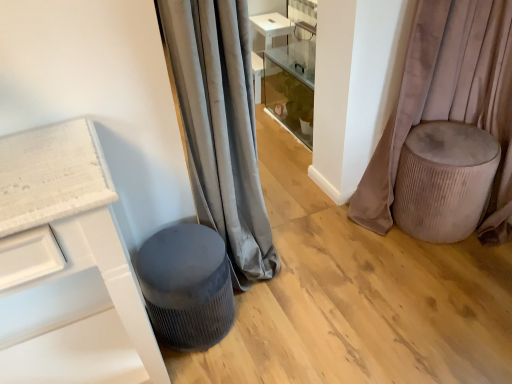
Identify the location of velvet grey stool at lower left. The height and width of the screenshot is (384, 512). point(187,286).

How much space does gray velvet curtain at center, the 2th curtain when ordered from right to left, occupy vertically?

It is 1.16 meters.

Identify the location of velvet beige ottoman at right. (444, 180).

Identify the location of velvet grey stool at lower left. (187, 286).

From a real-world perspective, who is located lower, velvet beige stool at right, the first curtain positioned from the right, or velvet beige ottoman at right?

In real-world perspective, velvet beige ottoman at right is lower.

Is velvet beige stool at right, the first curtain positioned from the right, wider than velvet beige ottoman at right?

Incorrect, the width of velvet beige stool at right, the first curtain positioned from the right, does not surpass that of velvet beige ottoman at right.

Is velvet beige ottoman at right inside velvet beige stool at right, the first curtain positioned from the right?

Yes, velvet beige ottoman at right is surrounded by velvet beige stool at right, the first curtain positioned from the right.

Is velvet grey stool at lower left turned away from gray velvet curtain at center, the 2th curtain when ordered from right to left?

No.

There is a velvet grey stool at lower left. At what (x,y) coordinates should I click in order to perform the action: click on the 1st curtain above it (from the image's perspective). Please return your answer as a coordinate pair (x, y). The height and width of the screenshot is (384, 512). Looking at the image, I should click on tap(220, 127).

Does velvet grey stool at lower left touch gray velvet curtain at center, which is the 1th curtain from left to right?

No, velvet grey stool at lower left is not touching gray velvet curtain at center, which is the 1th curtain from left to right.

From the image's perspective, which one is positioned higher, velvet beige ottoman at right or gray velvet curtain at center, the 2th curtain when ordered from right to left?

gray velvet curtain at center, the 2th curtain when ordered from right to left, from the image's perspective.

Could you measure the distance between velvet beige ottoman at right and gray velvet curtain at center, which is the 1th curtain from left to right?

They are 31.33 inches apart.

Does velvet beige ottoman at right appear on the left side of gray velvet curtain at center, which is the 1th curtain from left to right?

In fact, velvet beige ottoman at right is to the right of gray velvet curtain at center, which is the 1th curtain from left to right.

Find the location of a particular element. The image size is (512, 384). the 2nd curtain counting from the left side of the velvet beige ottoman at right is located at coordinates (220, 127).

Does point (424, 170) come farther from viewer compared to point (205, 249)?

Yes.

Is velvet beige ottoman at right looking in the opposite direction of velvet grey stool at lower left?

That's not correct — velvet beige ottoman at right is not looking away from velvet grey stool at lower left.

Considering the relative positions of velvet beige ottoman at right and velvet grey stool at lower left in the image provided, is velvet beige ottoman at right to the left or to the right of velvet grey stool at lower left?

Clearly, velvet beige ottoman at right is on the right of velvet grey stool at lower left in the image.

At what (x,y) coordinates should I click in order to perform the action: click on music stool that appears on the left of velvet beige ottoman at right. Please return your answer as a coordinate pair (x, y). This screenshot has width=512, height=384. Looking at the image, I should click on (187, 286).

Considering the sizes of objects gray velvet curtain at center, the 2th curtain when ordered from right to left, and velvet grey stool at lower left in the image provided, who is bigger, gray velvet curtain at center, the 2th curtain when ordered from right to left, or velvet grey stool at lower left?

Bigger between the two is gray velvet curtain at center, the 2th curtain when ordered from right to left.

Is gray velvet curtain at center, which is the 1th curtain from left to right, far away from velvet grey stool at lower left?

gray velvet curtain at center, which is the 1th curtain from left to right, is near velvet grey stool at lower left, not far away.

Is gray velvet curtain at center, which is the 1th curtain from left to right, to the left of velvet grey stool at lower left from the viewer's perspective?

No.

Is point (237, 121) farther from camera compared to point (201, 313)?

Yes, it is.

From a real-world perspective, is velvet grey stool at lower left over velvet beige stool at right, the 2th curtain positioned from the left?

Actually, velvet grey stool at lower left is physically below velvet beige stool at right, the 2th curtain positioned from the left, in the real world.

From the image's perspective, is velvet grey stool at lower left located above velvet beige stool at right, the first curtain positioned from the right?

No, from the image's perspective, velvet grey stool at lower left is not on top of velvet beige stool at right, the first curtain positioned from the right.

How much distance is there between velvet grey stool at lower left and velvet beige stool at right, the first curtain positioned from the right?

The distance of velvet grey stool at lower left from velvet beige stool at right, the first curtain positioned from the right, is 1.04 meters.

Is velvet grey stool at lower left located outside velvet beige stool at right, the 2th curtain positioned from the left?

Yes, velvet grey stool at lower left is not within velvet beige stool at right, the 2th curtain positioned from the left.

Is gray velvet curtain at center, the 2th curtain when ordered from right to left, to the left or to the right of velvet beige stool at right, the 2th curtain positioned from the left, in the image?

In the image, gray velvet curtain at center, the 2th curtain when ordered from right to left, appears on the left side of velvet beige stool at right, the 2th curtain positioned from the left.

Could you tell me if gray velvet curtain at center, which is the 1th curtain from left to right, is facing velvet beige stool at right, the 2th curtain positioned from the left?

No, gray velvet curtain at center, which is the 1th curtain from left to right, is not turned towards velvet beige stool at right, the 2th curtain positioned from the left.

Where is `curtain below the velvet beige stool at right, the 2th curtain positioned from the left (from the image's perspective)`? curtain below the velvet beige stool at right, the 2th curtain positioned from the left (from the image's perspective) is located at coordinates (220, 127).

Starting from the velvet beige ottoman at right, which curtain is the 1st one in front? Please provide its 2D coordinates.

[(449, 102)]

You are a GUI agent. You are given a task and a screenshot of the screen. Output one action in this format:
    pyautogui.click(x=<x>, y=<y>)
    Task: Click on the curtain that is the 2nd object above the velvet grey stool at lower left (from a real-world perspective)
    Image resolution: width=512 pixels, height=384 pixels.
    Given the screenshot: What is the action you would take?
    pyautogui.click(x=220, y=127)

Based on their spatial positions, is gray velvet curtain at center, the 2th curtain when ordered from right to left, or velvet beige stool at right, the 2th curtain positioned from the left, further from velvet beige ottoman at right?

Based on the image, gray velvet curtain at center, the 2th curtain when ordered from right to left, appears to be further to velvet beige ottoman at right.

Based on their spatial positions, is velvet grey stool at lower left or gray velvet curtain at center, the 2th curtain when ordered from right to left, closer to velvet beige stool at right, the 2th curtain positioned from the left?

Among the two, gray velvet curtain at center, the 2th curtain when ordered from right to left, is located nearer to velvet beige stool at right, the 2th curtain positioned from the left.

Looking at the image, which one is located closer to velvet grey stool at lower left, gray velvet curtain at center, the 2th curtain when ordered from right to left, or velvet beige ottoman at right?

gray velvet curtain at center, the 2th curtain when ordered from right to left.

Looking at the image, which one is located closer to velvet beige stool at right, the first curtain positioned from the right, gray velvet curtain at center, the 2th curtain when ordered from right to left, or velvet grey stool at lower left?

Among the two, gray velvet curtain at center, the 2th curtain when ordered from right to left, is located nearer to velvet beige stool at right, the first curtain positioned from the right.

Looking at the image, which one is located further to velvet beige ottoman at right, velvet grey stool at lower left or velvet beige stool at right, the first curtain positioned from the right?

velvet grey stool at lower left.

Which object lies further to the anchor point gray velvet curtain at center, which is the 1th curtain from left to right, velvet grey stool at lower left or velvet beige ottoman at right?

velvet beige ottoman at right is positioned further to the anchor gray velvet curtain at center, which is the 1th curtain from left to right.

Consider the image. Looking at the image, which one is located further to gray velvet curtain at center, the 2th curtain when ordered from right to left, velvet beige stool at right, the first curtain positioned from the right, or velvet beige ottoman at right?

velvet beige stool at right, the first curtain positioned from the right.

When comparing their distances from velvet beige ottoman at right, does velvet beige stool at right, the first curtain positioned from the right, or gray velvet curtain at center, which is the 1th curtain from left to right, seem further?

gray velvet curtain at center, which is the 1th curtain from left to right, lies further to velvet beige ottoman at right than the other object.

You are a GUI agent. You are given a task and a screenshot of the screen. Output one action in this format:
    pyautogui.click(x=<x>, y=<y>)
    Task: Click on the curtain located between gray velvet curtain at center, which is the 1th curtain from left to right, and velvet beige ottoman at right in the left-right direction
    
    Given the screenshot: What is the action you would take?
    pyautogui.click(x=449, y=102)

Identify the location of curtain located between velvet grey stool at lower left and velvet beige stool at right, the first curtain positioned from the right, in the left-right direction. (220, 127).